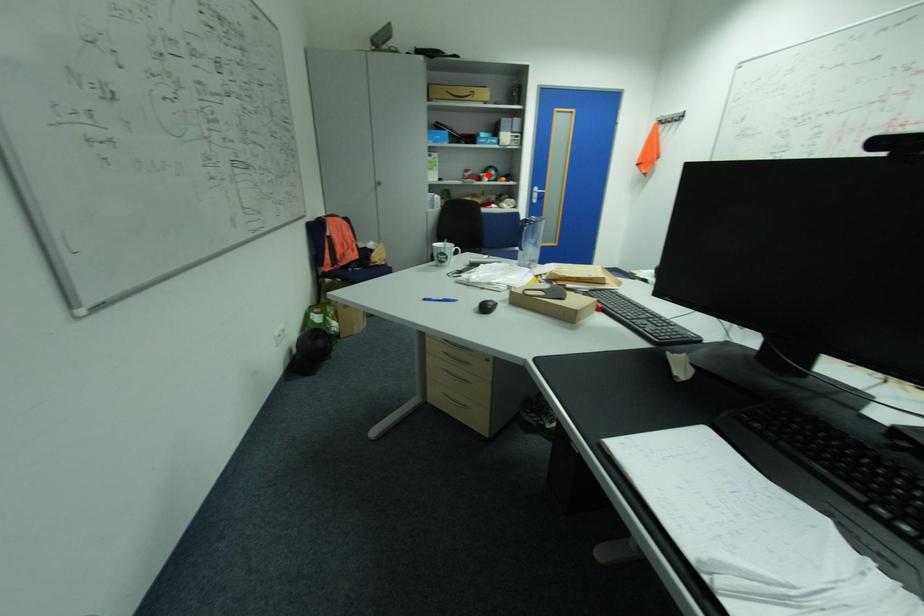
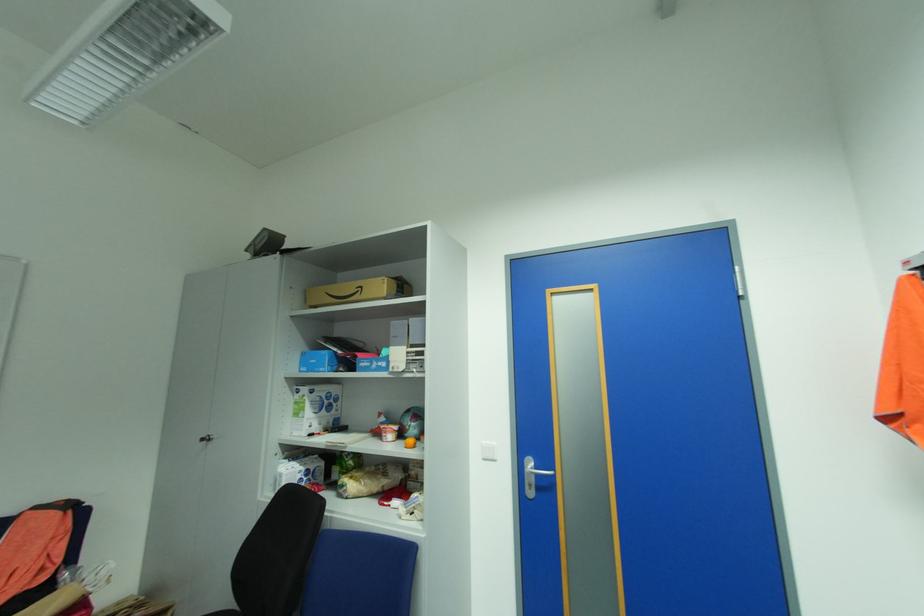
Question: I am providing you with two images of the same scene from different viewpoints. A red point is marked on the first image. Can you still see the location of the red point in image 2?

Choices:
 (A) Yes
 (B) No

Answer: (A)